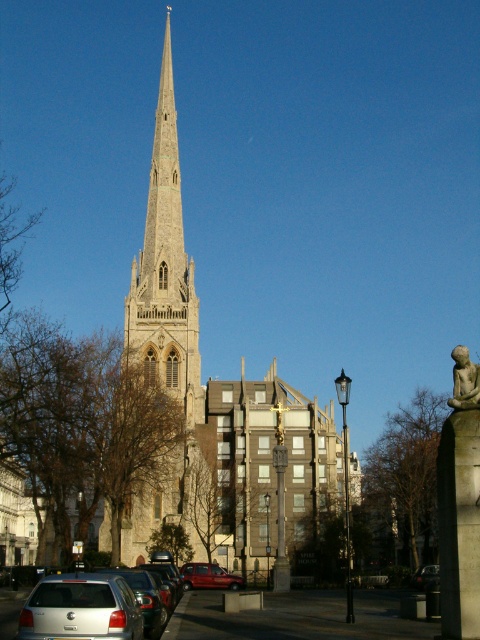
Question: Which point appears closest to the camera in this image?

Choices:
 (A) (454, 401)
 (B) (98, 577)
 (C) (199, 588)

Answer: (B)

Question: Is light gray stone spire at center-left below shiny black car at lower center?

Choices:
 (A) no
 (B) yes

Answer: (A)

Question: From the image, what is the correct spatial relationship of light gray stone spire at center-left in relation to shiny black car at lower center?

Choices:
 (A) above
 (B) below

Answer: (A)

Question: Can you confirm if light gray stone spire at center-left is positioned to the right of silver metallic hatchback at lower left?

Choices:
 (A) no
 (B) yes

Answer: (B)

Question: Among these objects, which one is farthest from the camera?

Choices:
 (A) matte stone statue at lower right
 (B) shiny black car at lower center
 (C) metallic red car at lower center

Answer: (C)

Question: Considering the real-world distances, which object is farthest from the silver metallic car at lower left?

Choices:
 (A) shiny black car at lower center
 (B) light gray stone spire at center-left
 (C) silver metallic hatchback at lower left

Answer: (A)